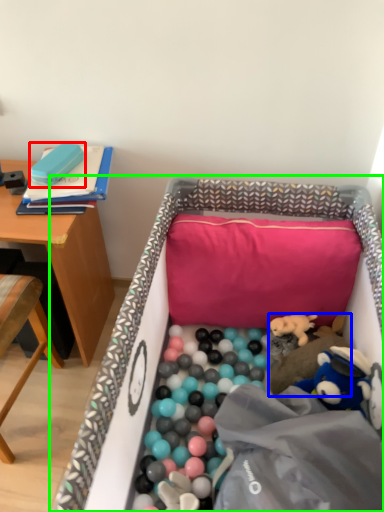
Question: Estimate the real-world distances between objects in this image. Which object is closer to toy (highlighted by a red box), toy (highlighted by a blue box) or infant bed (highlighted by a green box)?

Choices:
 (A) toy
 (B) infant bed

Answer: (B)